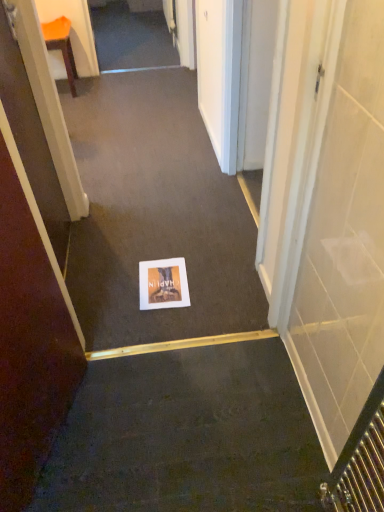
Question: Considering the positions of matte paper postcard at center and orange plastic chair at upper left in the image, is matte paper postcard at center wider or thinner than orange plastic chair at upper left?

Choices:
 (A) thin
 (B) wide

Answer: (A)

Question: Is matte paper postcard at center to the left or to the right of orange plastic chair at upper left in the image?

Choices:
 (A) left
 (B) right

Answer: (B)

Question: Which is nearer to the matte paper postcard at center?

Choices:
 (A) orange plastic chair at upper left
 (B) white paper at center
 (C) brown matte door at lower left

Answer: (B)

Question: Estimate the real-world distances between objects in this image. Which object is farther from the matte paper postcard at center?

Choices:
 (A) white paper at center
 (B) brown matte door at lower left
 (C) orange plastic chair at upper left

Answer: (C)